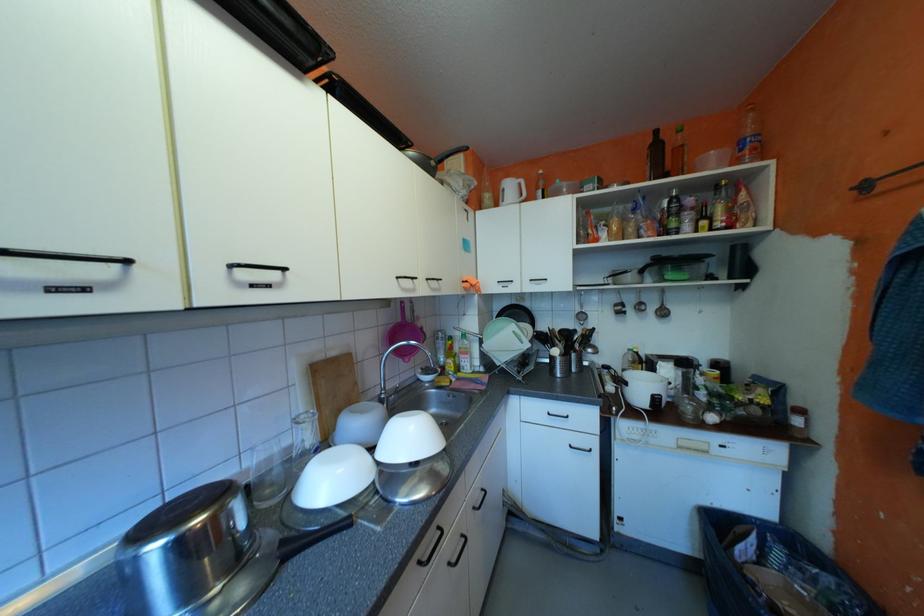
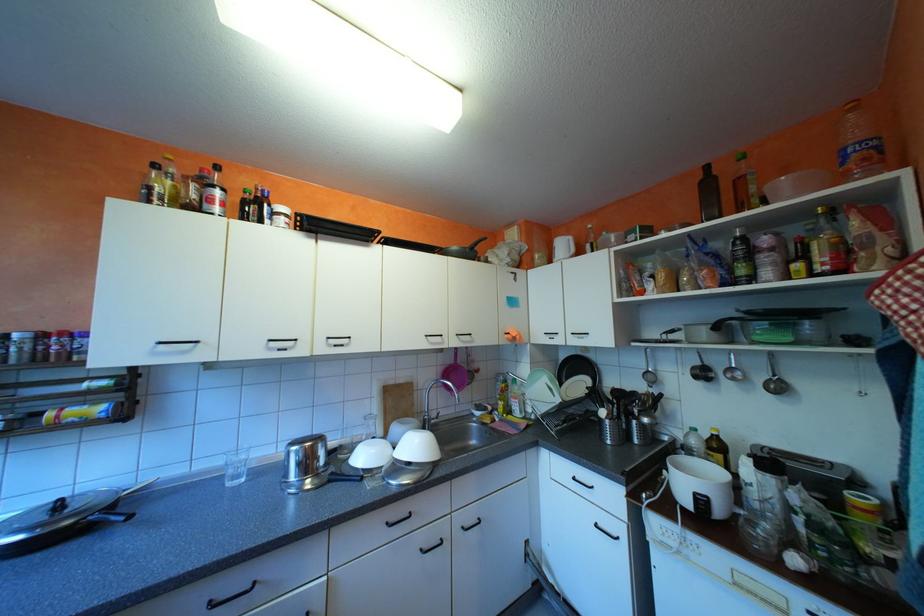
Where in the second image is the point corresponding to point (663, 307) from the first image?

(772, 377)